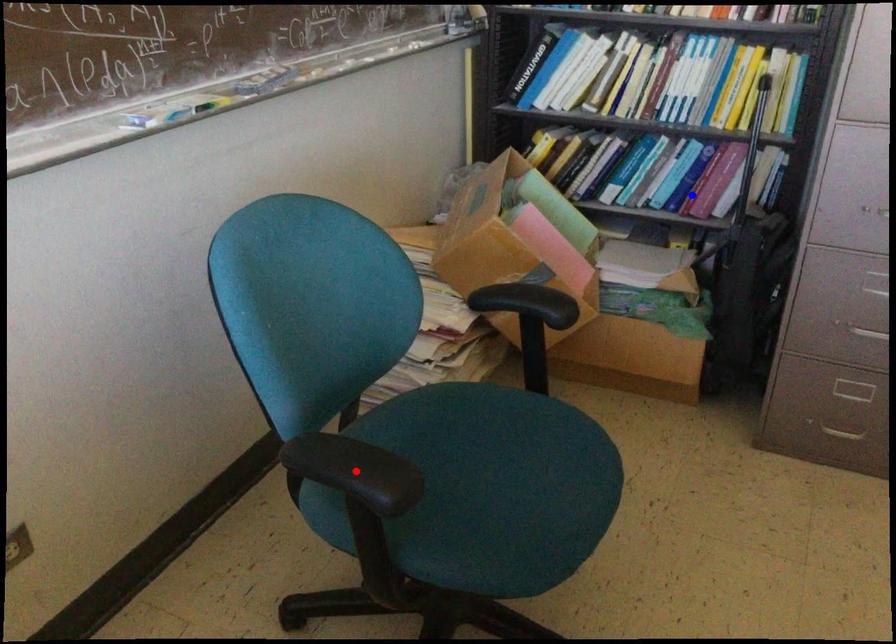
Question: In the image, two points are highlighted. Which point is nearer to the camera? Reply with the corresponding letter.

Choices:
 (A) blue point
 (B) red point

Answer: (B)